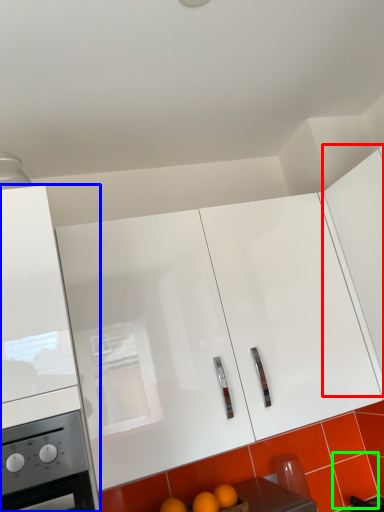
Question: Based on their relative distances, which object is farther from cabinetry (highlighted by a red box)? Choose from cabinetry (highlighted by a blue box) and tile (highlighted by a green box).

Choices:
 (A) cabinetry
 (B) tile

Answer: (A)